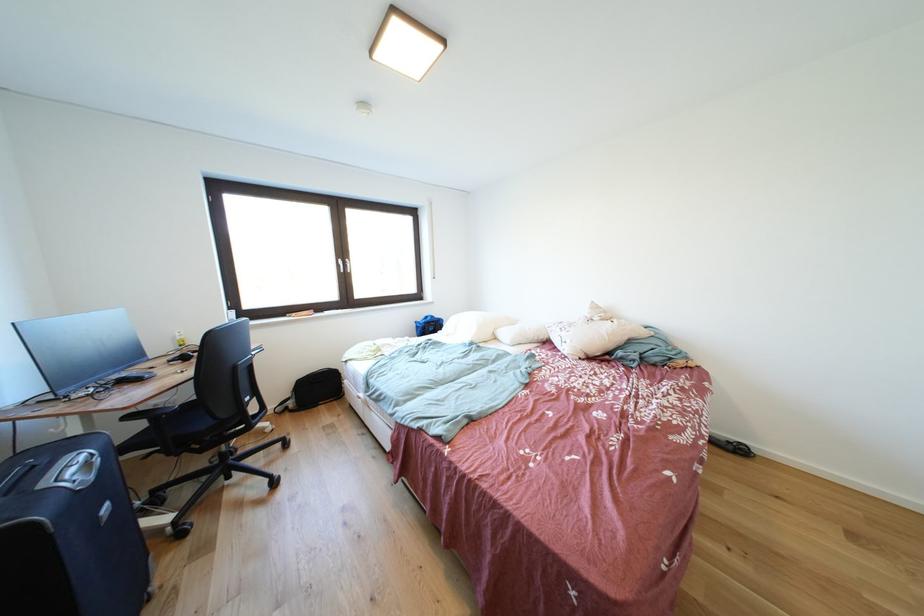
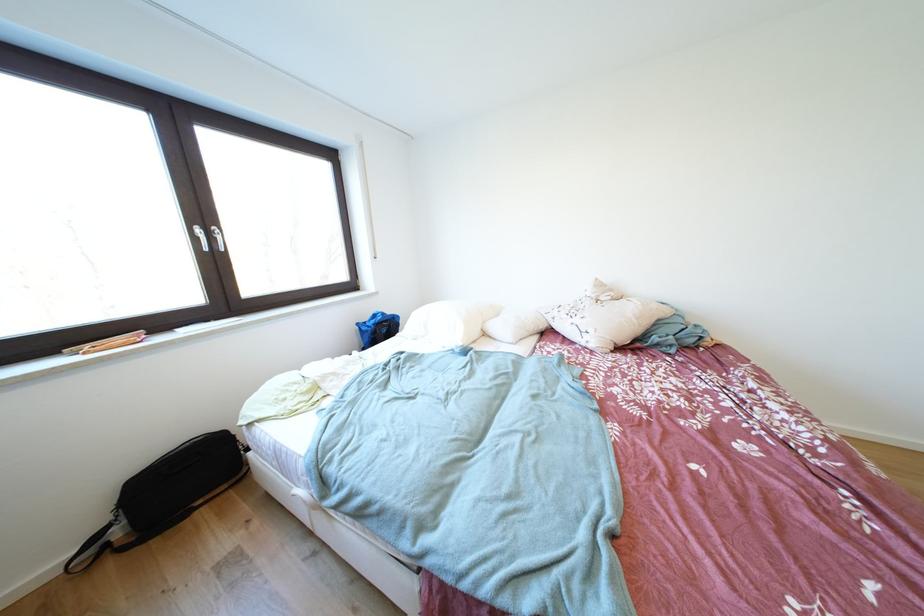
The point at [297,400] is marked in the first image. Where is the corresponding point in the second image?

(114, 524)